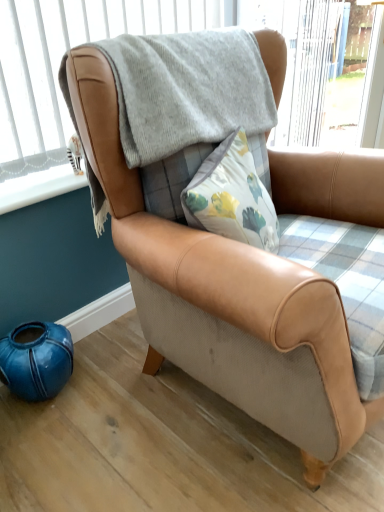
Image resolution: width=384 pixels, height=512 pixels. I want to click on vacant area on top of white plastic window sill at lower left (from a real-world perspective), so click(x=38, y=175).